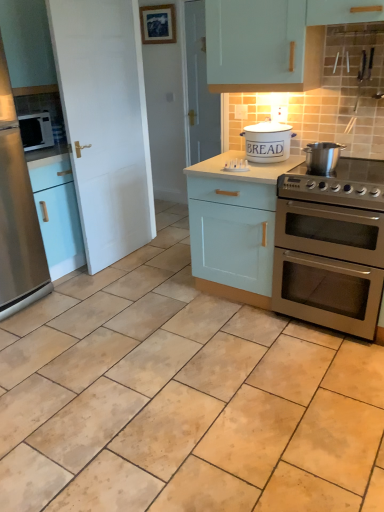
Question: Considering the relative positions of stainless steel pot at upper right, the second appliance viewed from the back, and light blue wood cabinet at center in the image provided, is stainless steel pot at upper right, the second appliance viewed from the back, behind light blue wood cabinet at center?

Choices:
 (A) yes
 (B) no

Answer: (B)

Question: Does stainless steel pot at upper right, which is counted as the 1th appliance, starting from the front, have a lesser width compared to light blue wood cabinet at center?

Choices:
 (A) yes
 (B) no

Answer: (A)

Question: Is stainless steel pot at upper right, the second appliance viewed from the back, wider than light blue wood cabinet at center?

Choices:
 (A) yes
 (B) no

Answer: (B)

Question: Considering the relative positions of stainless steel pot at upper right, the second appliance viewed from the back, and light blue wood cabinet at center in the image provided, is stainless steel pot at upper right, the second appliance viewed from the back, to the left of light blue wood cabinet at center from the viewer's perspective?

Choices:
 (A) no
 (B) yes

Answer: (A)

Question: Can you confirm if stainless steel pot at upper right, the second appliance viewed from the back, is smaller than light blue wood cabinet at center?

Choices:
 (A) yes
 (B) no

Answer: (A)

Question: Looking at the image, does stainless steel gas stove at right seem bigger or smaller compared to stainless steel refrigerator at left?

Choices:
 (A) big
 (B) small

Answer: (B)

Question: Is stainless steel gas stove at right inside the boundaries of stainless steel refrigerator at left, or outside?

Choices:
 (A) outside
 (B) inside

Answer: (A)

Question: Is stainless steel gas stove at right taller or shorter than stainless steel refrigerator at left?

Choices:
 (A) short
 (B) tall

Answer: (A)

Question: Considering the positions of point (379, 169) and point (8, 172), is point (379, 169) closer or farther from the camera than point (8, 172)?

Choices:
 (A) closer
 (B) farther

Answer: (A)

Question: Is point (21, 157) positioned closer to the camera than point (258, 144)?

Choices:
 (A) closer
 (B) farther

Answer: (B)

Question: From a real-world perspective, relative to white ceramic bread bin at center, the 1th appliance from the back, is stainless steel refrigerator at left vertically above or below?

Choices:
 (A) above
 (B) below

Answer: (B)

Question: Relative to white ceramic bread bin at center, the 2th appliance from the front, is stainless steel refrigerator at left in front or behind?

Choices:
 (A) front
 (B) behind

Answer: (A)

Question: Looking at their shapes, would you say stainless steel refrigerator at left is wider or thinner than white ceramic bread bin at center, the 1th appliance from the back?

Choices:
 (A) thin
 (B) wide

Answer: (B)

Question: Looking at their shapes, would you say satin silver microwave at left is wider or thinner than satin silver oven at right?

Choices:
 (A) thin
 (B) wide

Answer: (A)

Question: Is satin silver microwave at left inside the boundaries of satin silver oven at right, or outside?

Choices:
 (A) inside
 (B) outside

Answer: (B)